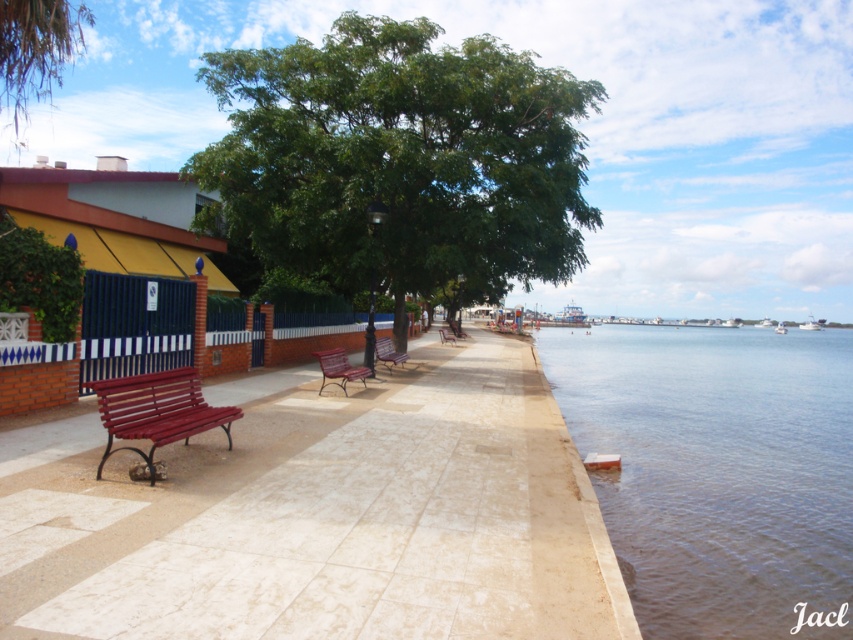
You are standing at the point marked as point (339, 368) in the image. What object is exactly at this location?

The wooden woven bench at center is located at point (339, 368).

You are designing a layout for a new park and want to place the matte red bench at left and the green leafy tree at upper center. Given their sizes, which object would require more horizontal space in the design plan?

The green leafy tree at upper center requires more horizontal space because its width is greater than the matte red bench at left.

You are standing on the walkway and want to sit on the bench closest to the tree. Which bench should you choose between the matte red bench at left and the metallic red bench at center?

The metallic red bench at center is closer to the tree. Since the matte red bench at left is to the left of the metallic red bench at center, the metallic red bench at center is positioned closer to the tree.